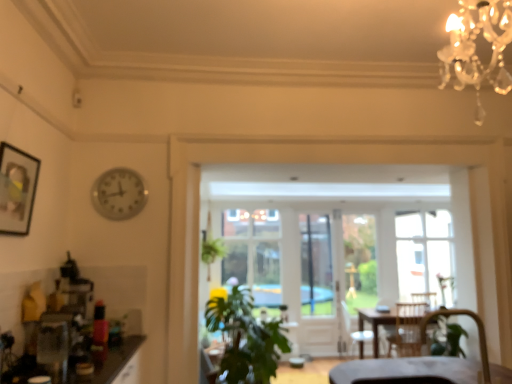
Question: From a real-world perspective, is metallic clock at upper left above or below velvet brown armchair at lower right, the 2th armchair positioned from the back?

Choices:
 (A) below
 (B) above

Answer: (B)

Question: In the image, is metallic clock at upper left positioned in front of or behind velvet brown armchair at lower right, which is the 2th armchair in bottom-to-top order?

Choices:
 (A) front
 (B) behind

Answer: (B)

Question: Estimate the real-world distances between objects in this image. Which object is farther from the matte black picture frame at upper left?

Choices:
 (A) green leafy plant at center
 (B) clear glass window at center
 (C) wooden armchair at center, which is counted as the 1th armchair, starting from the bottom
 (D) metallic clock at upper left
 (E) velvet brown armchair at lower right, the second armchair from the right

Answer: (B)

Question: Estimate the real-world distances between objects in this image. Which object is farther from the green leafy plant at center?

Choices:
 (A) metallic clock at upper left
 (B) velvet brown armchair at lower right, the 2th armchair positioned from the back
 (C) matte black picture frame at upper left
 (D) wooden armchair at center, which ranks as the 2th armchair in top-to-bottom order
 (E) clear glass screen door at center

Answer: (E)